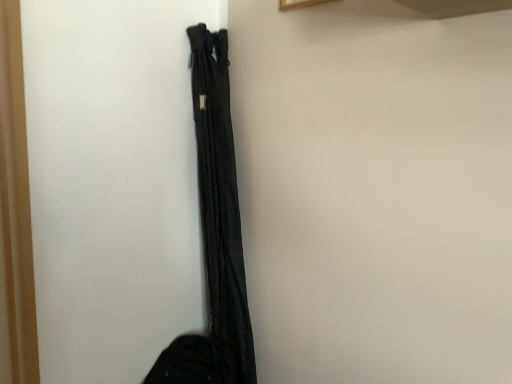
You are a GUI agent. You are given a task and a screenshot of the screen. Output one action in this format:
    pyautogui.click(x=<x>, y=<y>)
    Task: Click on the black fabric bag at upper right
    The image size is (512, 384).
    Given the screenshot: What is the action you would take?
    pyautogui.click(x=112, y=182)

Describe the element at coordinates (112, 182) in the screenshot. I see `black fabric bag at upper right` at that location.

The width and height of the screenshot is (512, 384). What are the coordinates of `black fabric curtain at center` in the screenshot? It's located at (220, 199).

Describe the element at coordinates (220, 199) in the screenshot. I see `black fabric curtain at center` at that location.

Locate an element on the screen. The image size is (512, 384). black fabric bag at upper right is located at coordinates (112, 182).

Visually, is black fabric curtain at center positioned to the left or to the right of black fabric bag at upper right?

Clearly, black fabric curtain at center is on the right of black fabric bag at upper right in the image.

Does black fabric curtain at center come behind black fabric bag at upper right?

Yes, black fabric curtain at center is behind black fabric bag at upper right.

Between point (212, 236) and point (181, 103), which one is positioned behind?

The point (212, 236) is farther.

From the image's perspective, relative to black fabric bag at upper right, is black fabric curtain at center above or below?

Clearly, from the image's perspective, black fabric curtain at center is below black fabric bag at upper right.

From a real-world perspective, relative to black fabric bag at upper right, is black fabric curtain at center vertically above or below?

black fabric curtain at center is situated lower than black fabric bag at upper right in the real world.

In terms of width, does black fabric curtain at center look wider or thinner when compared to black fabric bag at upper right?

black fabric curtain at center is thinner than black fabric bag at upper right.

Considering the sizes of objects black fabric curtain at center and black fabric bag at upper right in the image provided, who is taller, black fabric curtain at center or black fabric bag at upper right?

With more height is black fabric curtain at center.

Which of these two, black fabric curtain at center or black fabric bag at upper right, is bigger?

black fabric bag at upper right is bigger.

Is black fabric curtain at center not inside black fabric bag at upper right?

That's correct, black fabric curtain at center is outside of black fabric bag at upper right.

Is the surface of black fabric curtain at center in direct contact with black fabric bag at upper right?

They are not placed beside each other.

Does black fabric curtain at center turn towards black fabric bag at upper right?

Yes, black fabric curtain at center is facing black fabric bag at upper right.

How different are the orientations of black fabric curtain at center and black fabric bag at upper right in degrees?

The angle between the facing direction of black fabric curtain at center and the facing direction of black fabric bag at upper right is 2.23 degrees.

Image resolution: width=512 pixels, height=384 pixels. What are the coordinates of `curtain below the black fabric bag at upper right (from the image's perspective)` in the screenshot? It's located at (220, 199).

Does black fabric bag at upper right appear on the left side of black fabric curtain at center?

Correct, you'll find black fabric bag at upper right to the left of black fabric curtain at center.

Does black fabric bag at upper right come behind black fabric curtain at center?

No, the depth of black fabric bag at upper right is less than that of black fabric curtain at center.

Is point (181, 34) in front of point (199, 80)?

Yes, point (181, 34) is closer to viewer.

From the image's perspective, relative to black fabric curtain at center, is black fabric bag at upper right above or below?

black fabric bag at upper right is above black fabric curtain at center.

From a real-world perspective, is black fabric bag at upper right below black fabric curtain at center?

Incorrect, from a real-world perspective, black fabric bag at upper right is higher than black fabric curtain at center.

Considering the relative sizes of black fabric bag at upper right and black fabric curtain at center in the image provided, is black fabric bag at upper right wider than black fabric curtain at center?

Yes.

Which of these two, black fabric bag at upper right or black fabric curtain at center, stands shorter?

black fabric bag at upper right.

Between black fabric bag at upper right and black fabric curtain at center, which one has smaller size?

With smaller size is black fabric curtain at center.

In the scene shown: Is black fabric curtain at center completely or partially inside black fabric bag at upper right?

That's incorrect, black fabric curtain at center is not inside black fabric bag at upper right.

Would you consider black fabric bag at upper right to be distant from black fabric curtain at center?

No, black fabric bag at upper right is not far from black fabric curtain at center.

Is black fabric bag at upper right looking in the opposite direction of black fabric curtain at center?

Yes, black fabric bag at upper right's orientation is away from black fabric curtain at center.

Where is `screen door located in front of the black fabric curtain at center`? screen door located in front of the black fabric curtain at center is located at coordinates (112, 182).

Where is `screen door lying in front of the black fabric curtain at center`? screen door lying in front of the black fabric curtain at center is located at coordinates (112, 182).

Identify the location of screen door above the black fabric curtain at center (from a real-world perspective). The width and height of the screenshot is (512, 384). tap(112, 182).